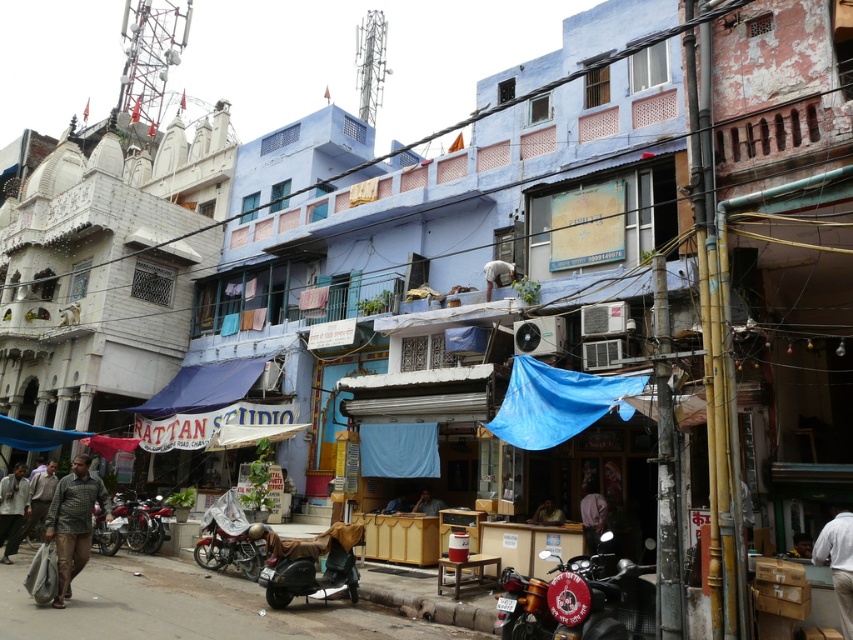
Question: Which point is farther to the camera?

Choices:
 (A) white fabric at center
 (B) light brown fabric pants at lower left

Answer: (A)

Question: Does shiny black motorcycle at lower right appear on the left side of light brown leather jacket at center?

Choices:
 (A) yes
 (B) no

Answer: (A)

Question: Considering the relative positions of shiny black motorcycle at lower right and dark brown leather jacket at lower left in the image provided, where is shiny black motorcycle at lower right located with respect to dark brown leather jacket at lower left?

Choices:
 (A) right
 (B) left

Answer: (A)

Question: Which of these objects is positioned closest to the dark gray matte scooter at center?

Choices:
 (A) dark brown leather jacket at center
 (B) white fabric at center
 (C) plaid shirt at lower left

Answer: (C)

Question: Can you confirm if shiny black motorcycle at lower right is positioned above metallic red motorcycle at lower center?

Choices:
 (A) yes
 (B) no

Answer: (A)

Question: Considering the real-world distances, which object is closest to the dark brown leather jacket at lower left?

Choices:
 (A) light brown leather jacket at lower right
 (B) dark purple fabric at center

Answer: (B)